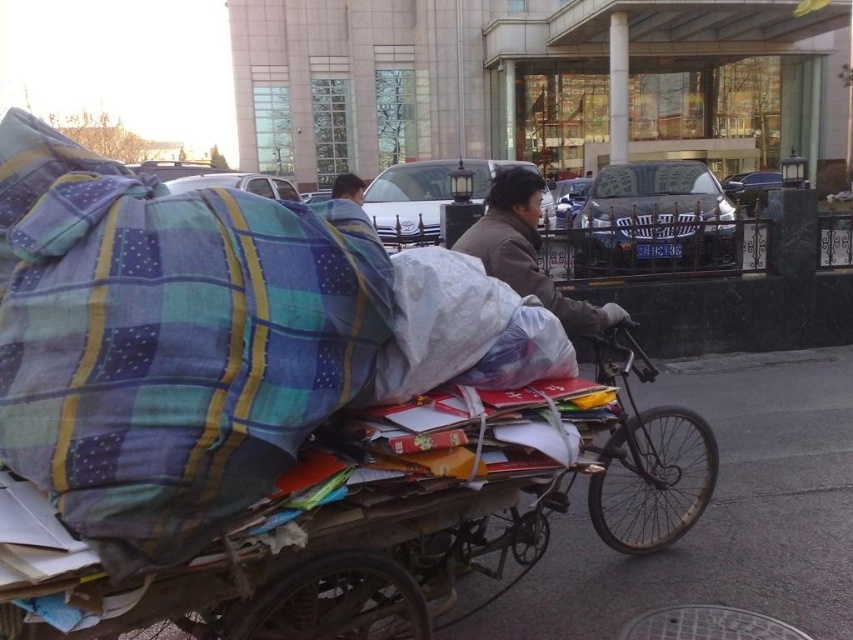
Question: Is metallic silver bicycle at right positioned at the back of dark brown hair at upper center?

Choices:
 (A) yes
 (B) no

Answer: (B)

Question: Among these objects, which one is farthest from the camera?

Choices:
 (A) metallic silver car at center
 (B) metallic silver bicycle at right
 (C) wooden cart at center

Answer: (A)

Question: Which of the following is the farthest from the observer?

Choices:
 (A) (589, 323)
 (B) (618, 164)
 (C) (347, 186)

Answer: (B)

Question: Does metallic silver bicycle at right have a lesser width compared to dark brown hair at upper center?

Choices:
 (A) yes
 (B) no

Answer: (A)

Question: Which object appears farthest from the camera in this image?

Choices:
 (A) dark brown hair at upper center
 (B) wooden cart at center

Answer: (A)

Question: In this image, where is wooden cart at center located relative to metallic silver bicycle at right?

Choices:
 (A) left
 (B) right

Answer: (A)